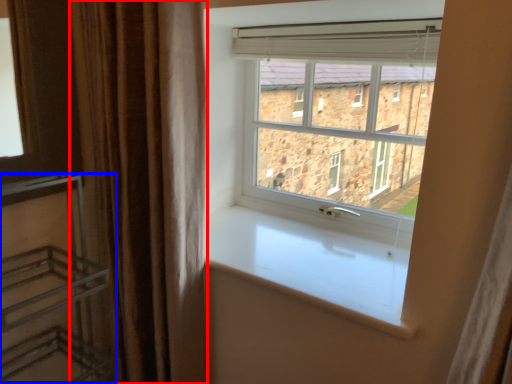
Question: Which object is further to the camera taking this photo, curtain (highlighted by a red box) or shelf (highlighted by a blue box)?

Choices:
 (A) curtain
 (B) shelf

Answer: (A)